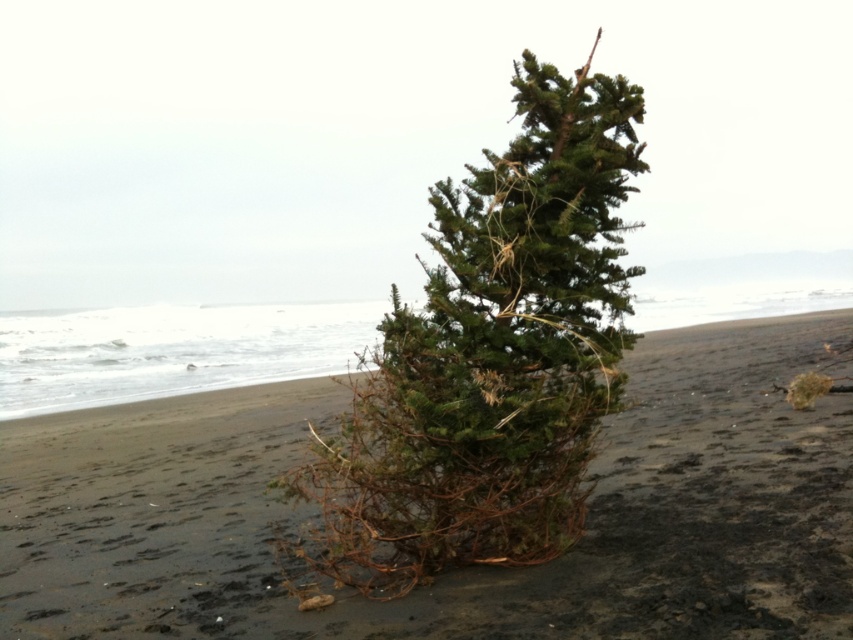
Consider the image. You are standing on the sandy beach looking at the solitary evergreen tree. There are two points marked on the image at coordinates point (717, 625) and point (486, 260). Which point is closer to you as you face the tree?

Point (717, 625) is in front of point (486, 260), so it is closer to you as you face the tree.